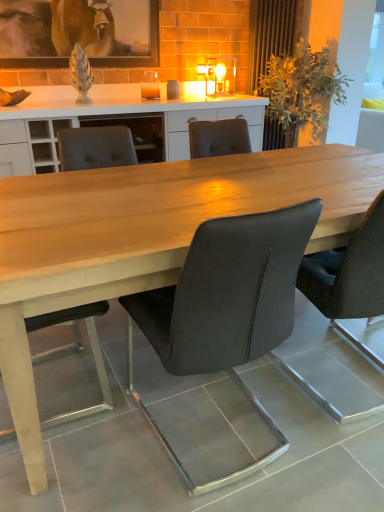
Question: In which direction should I rotate to look at matte black chair at center, which ranks as the 2th chair in right-to-left order?

Choices:
 (A) right
 (B) left

Answer: (A)

Question: Does matte black chair at center, which ranks as the 2th chair in right-to-left order, have a smaller size compared to matte black chair at center, which appears as the third chair when viewed from the right?

Choices:
 (A) yes
 (B) no

Answer: (B)

Question: Considering the relative sizes of matte black chair at center, marked as the 2th chair in a left-to-right arrangement, and matte black chair at center, which appears as the third chair when viewed from the right, in the image provided, is matte black chair at center, marked as the 2th chair in a left-to-right arrangement, thinner than matte black chair at center, which appears as the third chair when viewed from the right,?

Choices:
 (A) yes
 (B) no

Answer: (B)

Question: Can you confirm if matte black chair at center, marked as the 2th chair in a left-to-right arrangement, is positioned to the left of matte black chair at center, which appears as the third chair when viewed from the right?

Choices:
 (A) no
 (B) yes

Answer: (A)

Question: Are matte black chair at center, which ranks as the 2th chair in right-to-left order, and matte black chair at center, which appears as the third chair when viewed from the right, located far from each other?

Choices:
 (A) no
 (B) yes

Answer: (A)

Question: From the image's perspective, does matte black chair at center, which ranks as the 2th chair in right-to-left order, appear higher than matte black chair at center, the 1th chair viewed from the left?

Choices:
 (A) no
 (B) yes

Answer: (A)

Question: Can you confirm if matte black chair at center, marked as the 2th chair in a left-to-right arrangement, is bigger than matte black chair at center, the 1th chair viewed from the left?

Choices:
 (A) no
 (B) yes

Answer: (B)

Question: Does matte black chair at center, which appears as the third chair when viewed from the right, appear on the left side of matte wooden picture frame at upper center?

Choices:
 (A) no
 (B) yes

Answer: (A)

Question: Is matte black chair at center, which appears as the third chair when viewed from the right, smaller than matte wooden picture frame at upper center?

Choices:
 (A) no
 (B) yes

Answer: (A)

Question: Is matte black chair at center, the 1th chair viewed from the left, oriented away from matte wooden picture frame at upper center?

Choices:
 (A) no
 (B) yes

Answer: (A)

Question: Considering the relative sizes of matte black chair at center, the 1th chair viewed from the left, and matte wooden picture frame at upper center in the image provided, is matte black chair at center, the 1th chair viewed from the left, taller than matte wooden picture frame at upper center?

Choices:
 (A) yes
 (B) no

Answer: (A)

Question: Is matte black chair at center, the 1th chair viewed from the left, thinner than matte wooden picture frame at upper center?

Choices:
 (A) yes
 (B) no

Answer: (B)

Question: From the image's perspective, is matte black chair at center, the 1th chair viewed from the left, on top of matte wooden picture frame at upper center?

Choices:
 (A) no
 (B) yes

Answer: (A)

Question: Is matte black chair at center, which ranks as the 2th chair in right-to-left order, at the back of matte wooden picture frame at upper center?

Choices:
 (A) yes
 (B) no

Answer: (B)